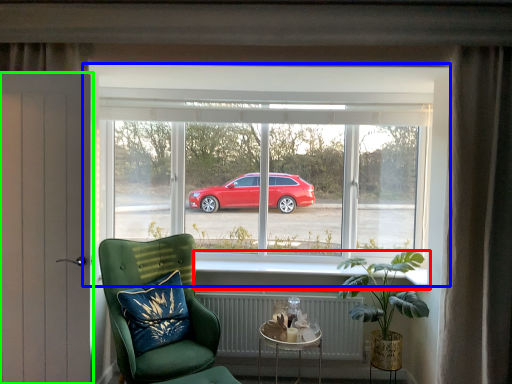
Question: Which object is the closest to the window sill (highlighted by a red box)? Choose among these: window (highlighted by a blue box) or door (highlighted by a green box).

Choices:
 (A) window
 (B) door

Answer: (A)